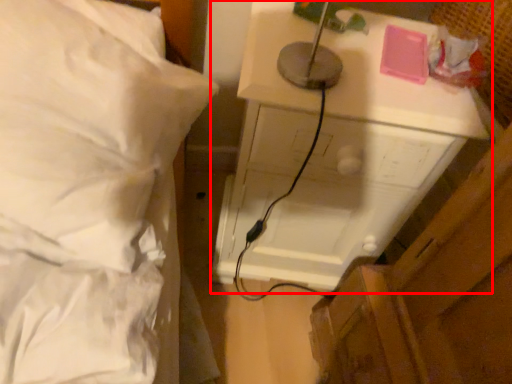
Question: From the image's perspective, where is furniture (annotated by the red box) located relative to bed?

Choices:
 (A) above
 (B) below

Answer: (B)